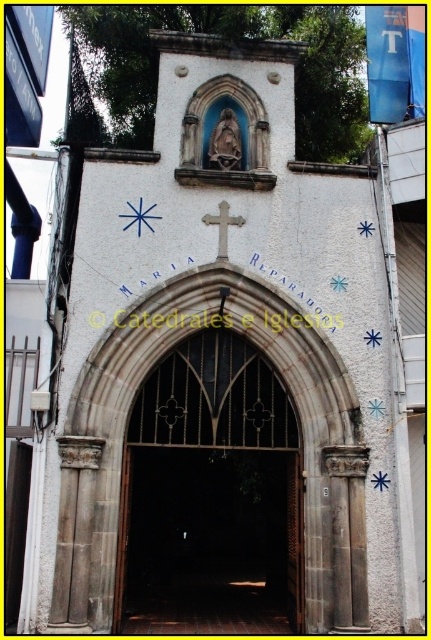
Based on the coordinates provided, which object is located at point (x=211, y=493) in the church entrance scene?

The dark brown stone arch at center is located at point (x=211, y=493).

You are standing at the entrance of the church and notice the dark brown stone arch at center and the white stone cross at center. Which object is positioned higher up?

The white stone cross at center is positioned higher up because it is above the dark brown stone arch at center.

In the scene shown: You are standing at the entrance of the church and notice two points marked on the archway. The first point is located at coordinates point (125, 497) and the second at point (221, 248). Which of these points is positioned closer to your current viewpoint?

Point (125, 497) is closer to the viewer than point (221, 248), so the first point is closer to your current viewpoint.